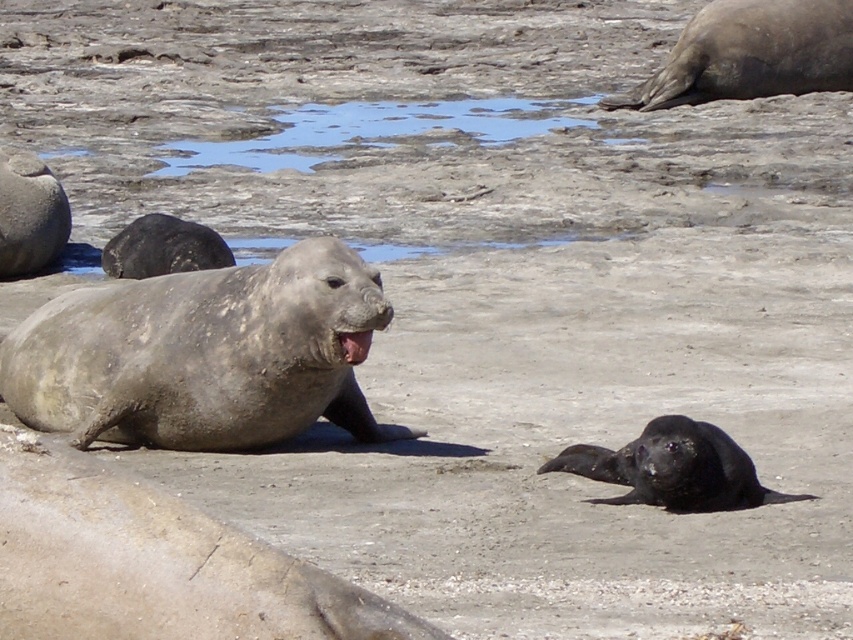
You are standing on the beach and want to take a photo of the seals. The camera you have can only focus on objects within 50 feet. Is the point at coordinates point (694, 68) within the camera focus range?

The point point (694, 68) is 64.75 feet from the viewer, which is beyond the camera focus range of 50 feet. The camera cannot focus on it.

Based on the photo, you are a wildlife photographer standing at the edge of the beach. You want to take a photo of both the gray matte seal mouth at left and the gray matte seal at upper right in the same frame. Given that your camera has a maximum zoom range of 10 meters, can you capture both subjects without moving closer?

The distance between the gray matte seal mouth at left and the gray matte seal at upper right is 12.56 meters, which exceeds the camera maximum zoom range of 10 meters. Therefore, you cannot capture both subjects in the same frame without moving closer.

You are a wildlife photographer standing at the edge of the beach. You want to take a photo that includes both the gray matte seal at upper right and the black fur seal at lower right. Given that your camera has a maximum zoom range of 10 meters, will you be able to capture both seals in a single frame without moving closer?

The gray matte seal at upper right is 13.20 meters away from the black fur seal at lower right. Since your camera can only zoom up to 10 meters, you won t be able to capture both seals in a single frame without moving closer.